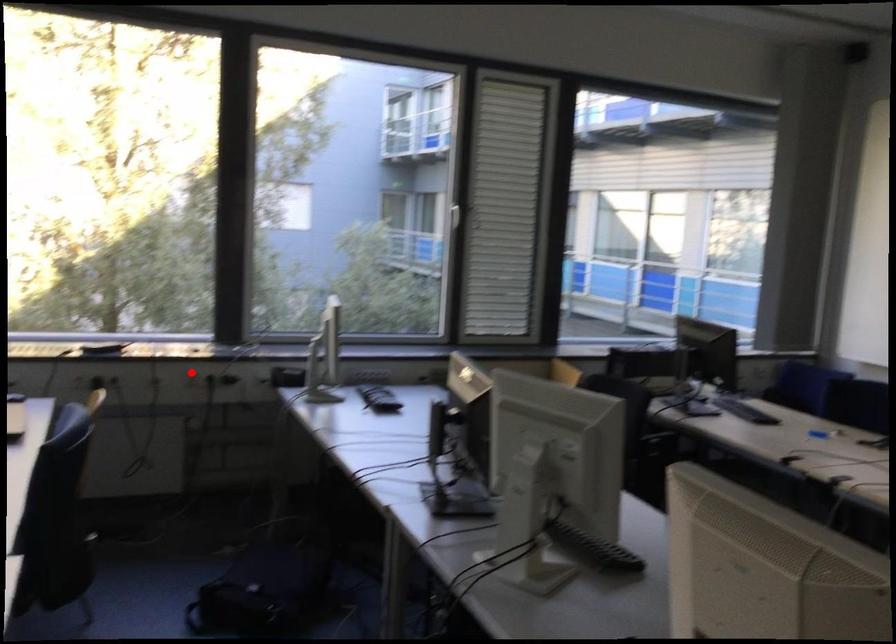
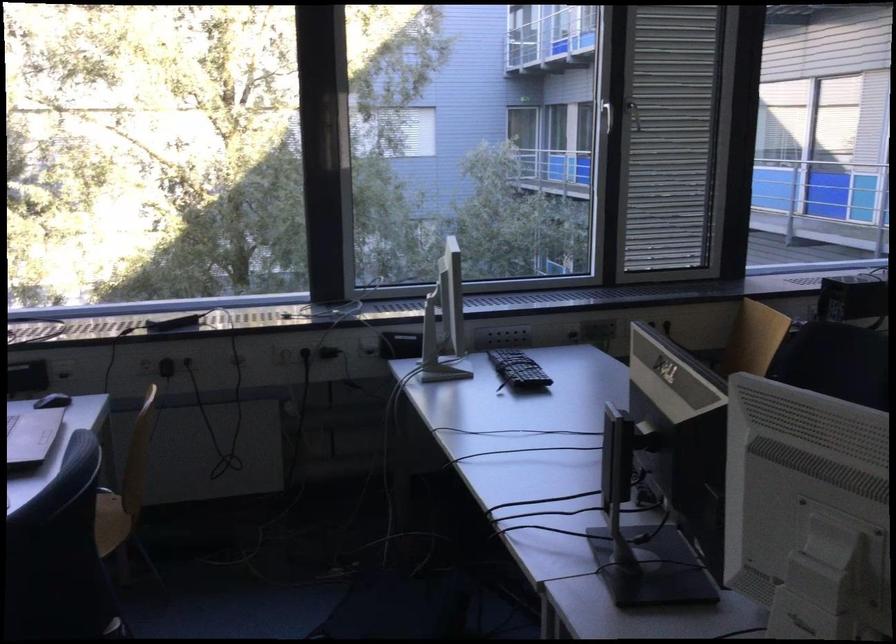
The point at the highlighted location is marked in the first image. Where is the corresponding point in the second image?

(285, 354)